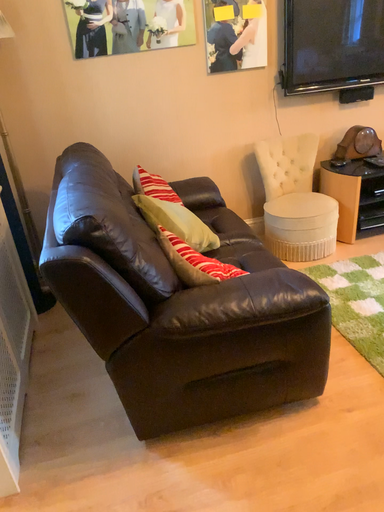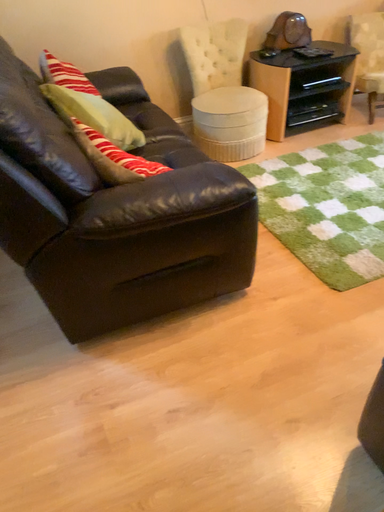
Question: How did the camera likely rotate when shooting the video?

Choices:
 (A) rotated left
 (B) rotated right

Answer: (B)